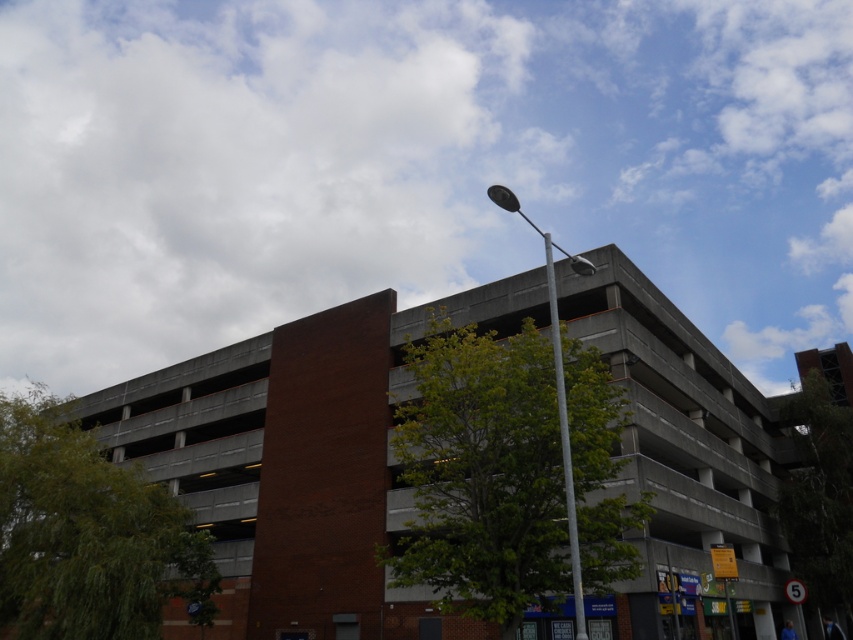
Is white fluffy cloud at upper center to the left of silver metallic pole at upper center from the viewer's perspective?

Correct, you'll find white fluffy cloud at upper center to the left of silver metallic pole at upper center.

Does white fluffy cloud at upper center have a larger size compared to silver metallic pole at upper center?

Correct, white fluffy cloud at upper center is larger in size than silver metallic pole at upper center.

Measure the distance between point (659, 13) and camera.

Point (659, 13) is 198.44 meters away from camera.

The image size is (853, 640). Find the location of `white fluffy cloud at upper center`. white fluffy cloud at upper center is located at coordinates (410, 164).

Who is higher up, metallic pole at upper center or silver metallic pole at upper center?

metallic pole at upper center is higher up.

Who is more distant from viewer, (573, 573) or (573, 531)?

The point (573, 531) is behind.

Is point (552, 273) positioned in front of point (547, 234)?

Yes, it is in front of point (547, 234).

Find the location of `metallic pole at upper center`. metallic pole at upper center is located at coordinates (556, 392).

Measure the distance between white fluffy cloud at upper center and camera.

30.47 meters

Between point (567, 64) and point (570, 540), which one is positioned in front?

Point (570, 540)

Identify the location of white fluffy cloud at upper center. click(410, 164).